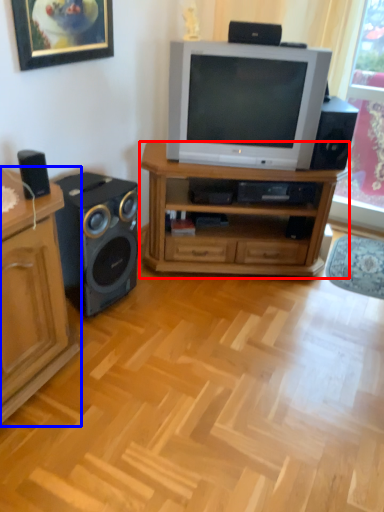
Question: Which point is closer to the camera, desk (highlighted by a red box) or cabinetry (highlighted by a blue box)?

Choices:
 (A) desk
 (B) cabinetry

Answer: (B)